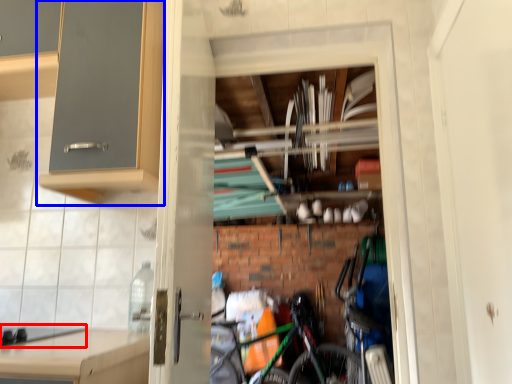
Question: Among these objects, which one is nearest to the camera, gas stove (highlighted by a red box) or cabinetry (highlighted by a blue box)?

Choices:
 (A) gas stove
 (B) cabinetry

Answer: (A)